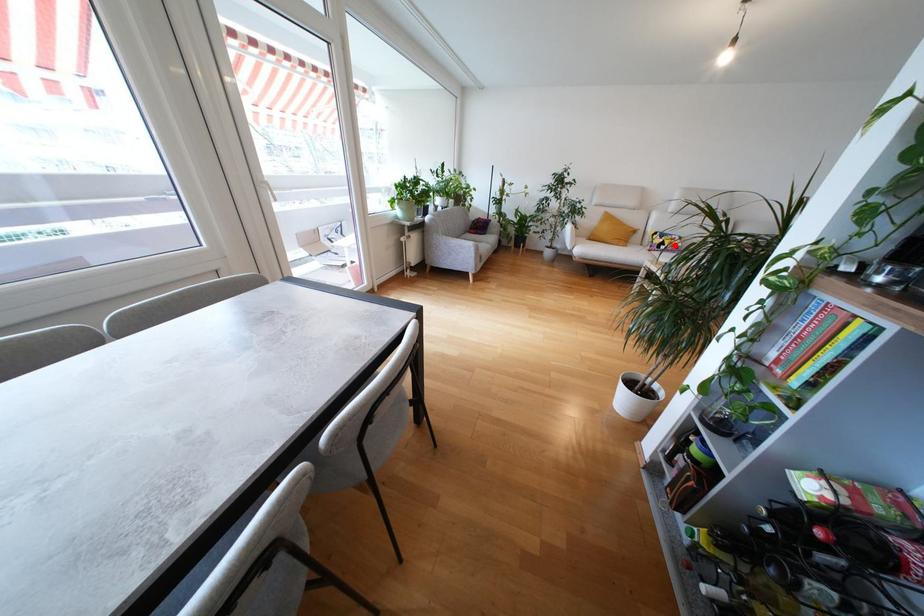
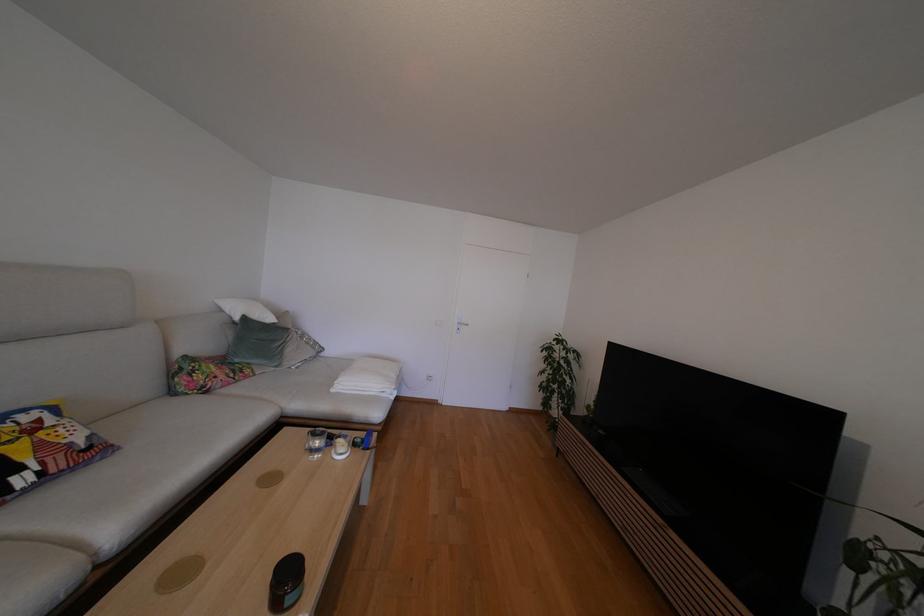
Question: A red point is marked in image1. In image2, is the corresponding 3D point closer to the camera or farther? Reply with the corresponding letter.

Choices:
 (A) The corresponding 3D point is closer.
 (B) The corresponding 3D point is farther.

Answer: (A)